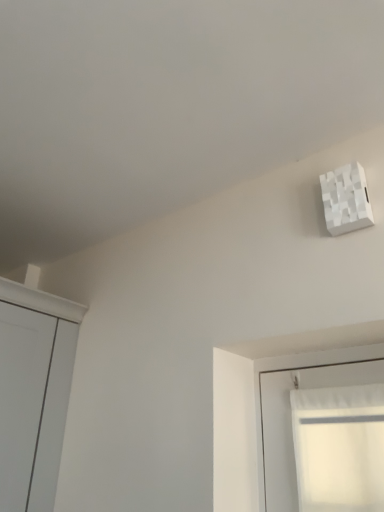
What do you see at coordinates (346, 199) in the screenshot? I see `white matte/light switch at upper right` at bounding box center [346, 199].

Find the location of `white matte/light switch at upper right`. white matte/light switch at upper right is located at coordinates (346, 199).

You are a GUI agent. You are given a task and a screenshot of the screen. Output one action in this format:
    pyautogui.click(x=<x>, y=<y>)
    Task: Click on the white matte/light switch at upper right
    
    Given the screenshot: What is the action you would take?
    pyautogui.click(x=346, y=199)